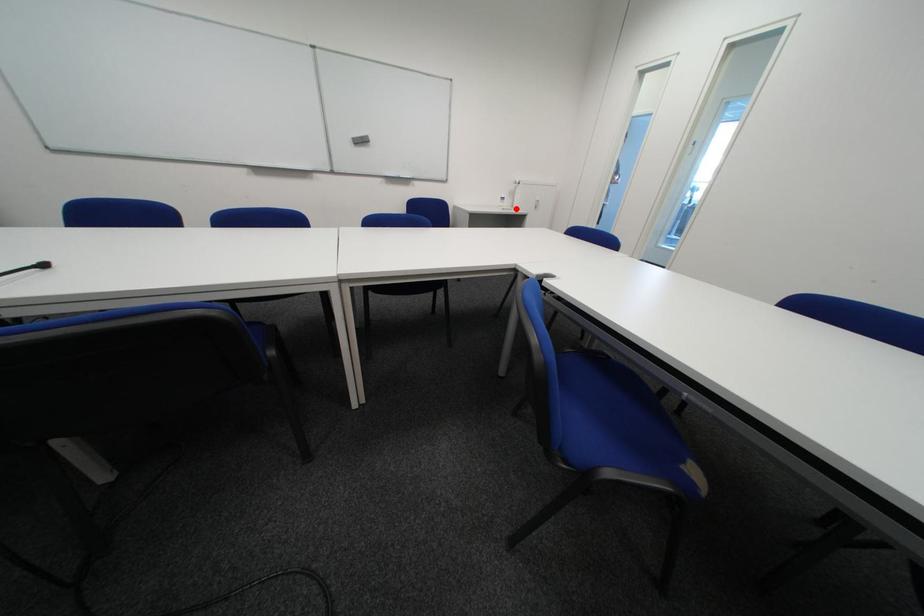
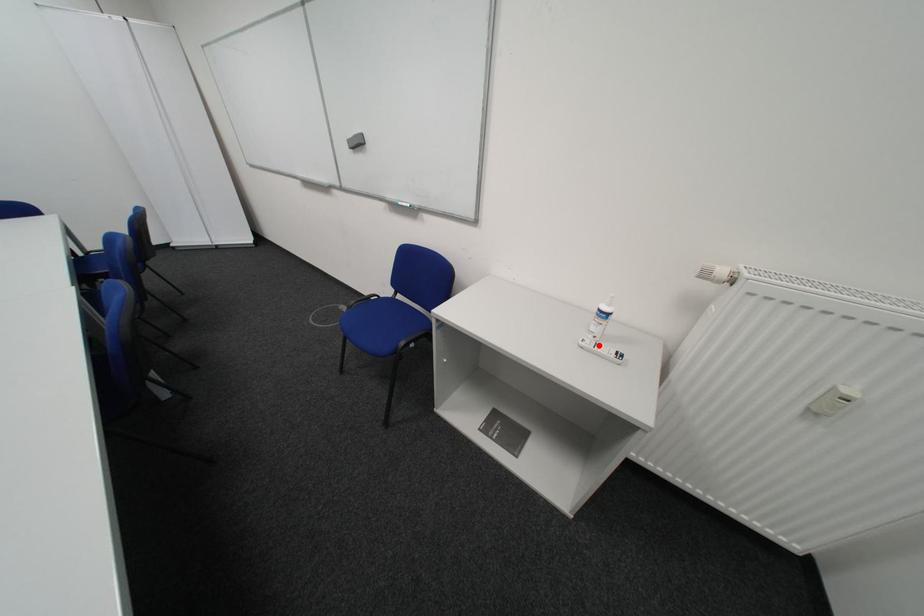
I am providing you with two images of the same scene from different viewpoints. A red point is marked on the first image and another point is marked on the second image. Do the highlighted points in image1 and image2 indicate the same real-world spot?

Yes